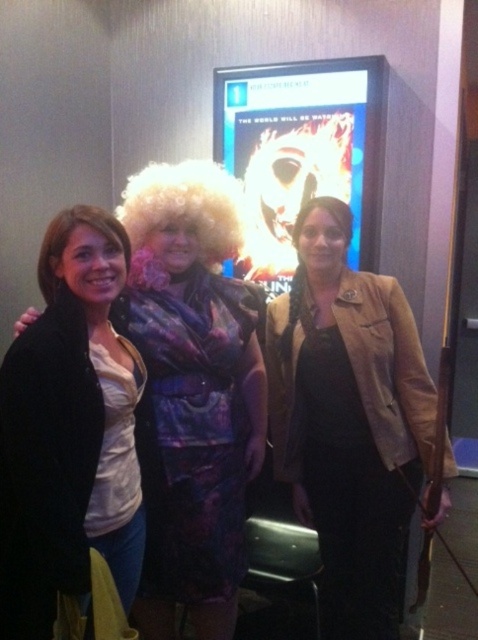
Based on the scene description, where is the tan leather jacket at center located in terms of coordinates?

The tan leather jacket at center is located at coordinates point (348, 422).

You are standing at the center of the room and want to move towards the two points marked in the image. Which point, point 1 at coordinates (348,557) or point 2 at coordinates (344,157), is closer to you?

Point 1 at coordinates (348,557) is closer to you because it is in front of point 2 at coordinates (344,157).